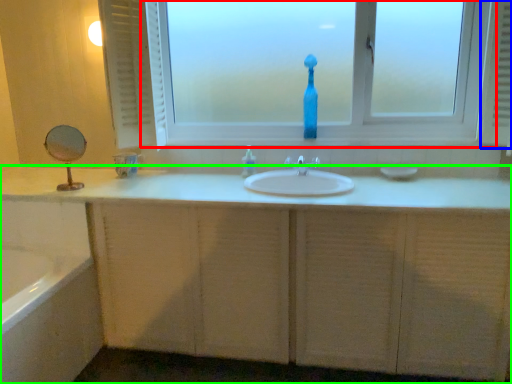
Question: Which object is the closest to the window (highlighted by a red box)? Choose among these: radiator (highlighted by a blue box) or bathroom cabinet (highlighted by a green box).

Choices:
 (A) radiator
 (B) bathroom cabinet

Answer: (A)